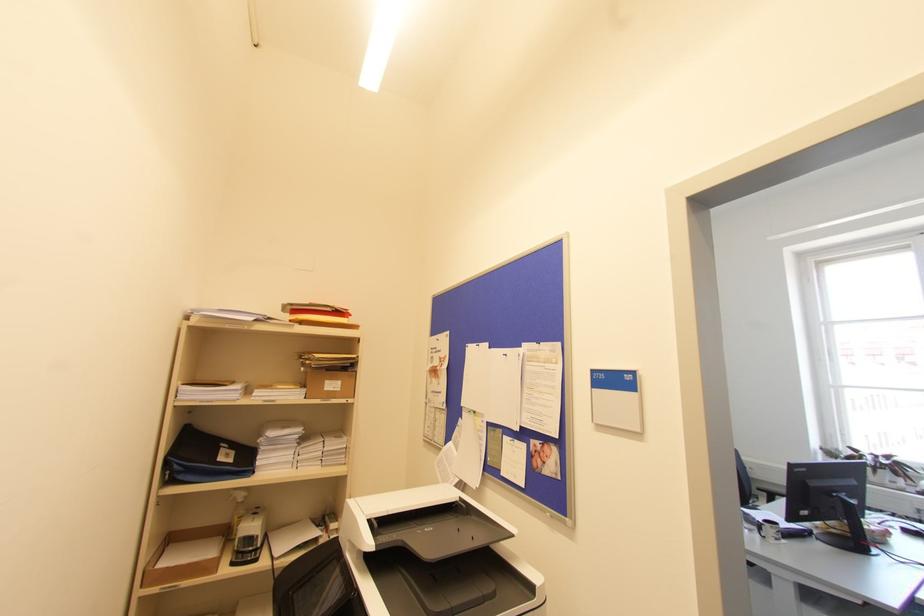
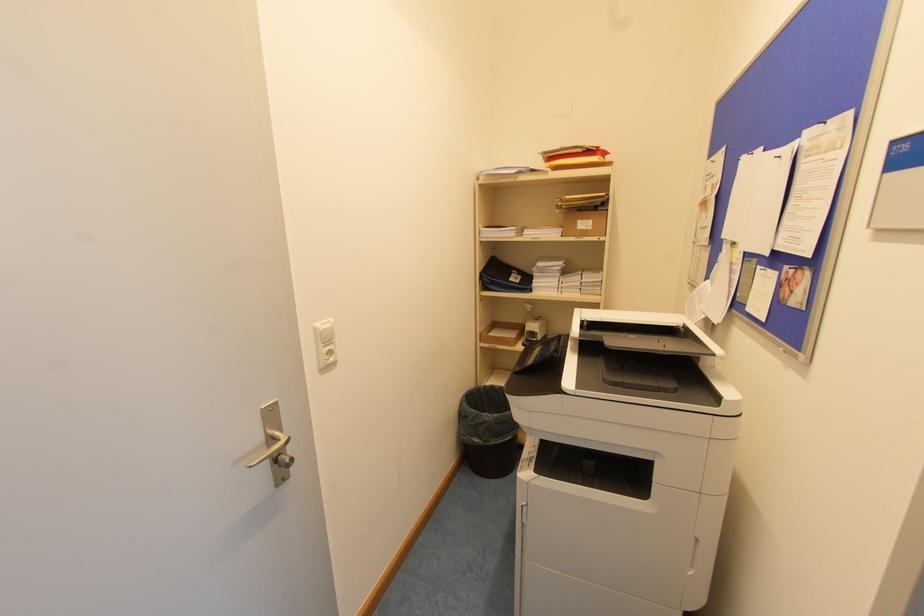
Locate, in the second image, the point that corresponds to (x=333, y=387) in the first image.

(585, 225)